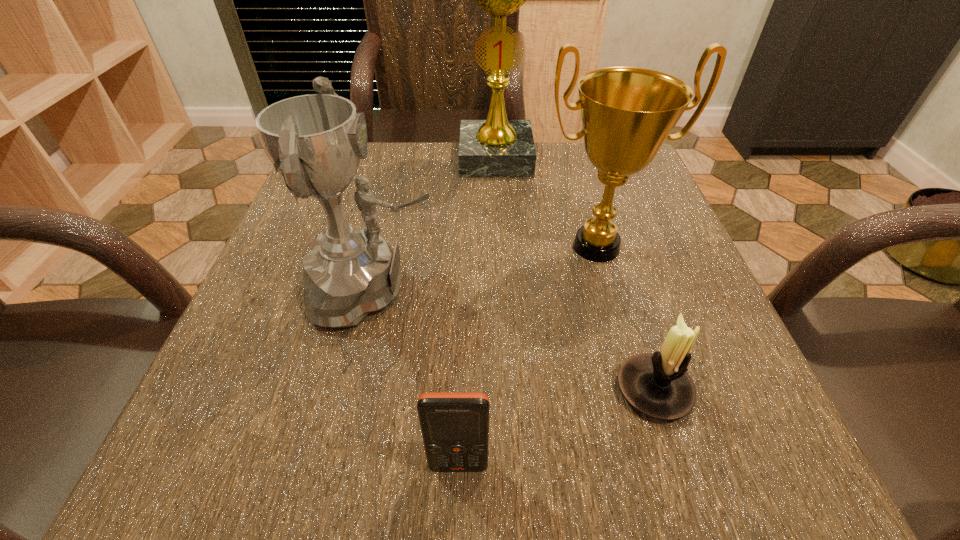
Locate an element on the screen. object positioned at the left edge is located at coordinates (316, 141).

You are a GUI agent. You are given a task and a screenshot of the screen. Output one action in this format:
    pyautogui.click(x=<x>, y=<y>)
    Task: Click on the award that is positioned at the right edge
    
    Given the screenshot: What is the action you would take?
    [627, 113]

This screenshot has width=960, height=540. What are the coordinates of `candle holder that is positioned at the right edge` in the screenshot? It's located at (657, 385).

This screenshot has height=540, width=960. I want to click on object present at the near right corner, so click(x=657, y=385).

Identify the location of vacant space at the far edge. This screenshot has width=960, height=540. (568, 147).

This screenshot has height=540, width=960. I want to click on vacant space at the near edge of the desktop, so click(642, 431).

Identify the location of vacant space at the left edge. (247, 356).

You are a GUI agent. You are given a task and a screenshot of the screen. Output one action in this format:
    pyautogui.click(x=<x>, y=<y>)
    Task: Click on the free spot at the right edge of the desktop
    
    Given the screenshot: What is the action you would take?
    coord(674,241)

You are a GUI agent. You are given a task and a screenshot of the screen. Output one action in this format:
    pyautogui.click(x=<x>, y=<y>)
    Task: Click on the vacant space at the near left corner of the desktop
    Image resolution: width=960 pixels, height=540 pixels.
    Given the screenshot: What is the action you would take?
    pyautogui.click(x=262, y=465)

In the image, there is a desktop. At what (x,y) coordinates should I click in order to perform the action: click on vacant space at the far right corner. Please return your answer as a coordinate pair (x, y). This screenshot has height=540, width=960. Looking at the image, I should click on (639, 175).